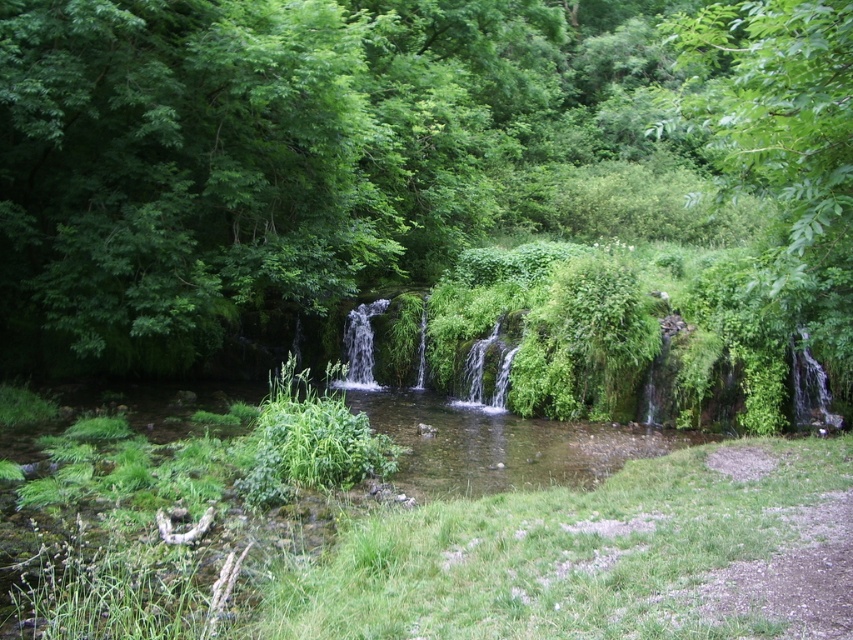
Question: Does green leafy tree at center appear under green leafy tree at upper right?

Choices:
 (A) no
 (B) yes

Answer: (B)

Question: Among these objects, which one is nearest to the camera?

Choices:
 (A) green leafy tree at center
 (B) green leafy tree at upper right

Answer: (A)

Question: Among these points, which one is farthest from the camera?

Choices:
 (A) (799, 157)
 (B) (77, 250)

Answer: (B)

Question: Is green leafy tree at center positioned in front of green leafy tree at upper right?

Choices:
 (A) no
 (B) yes

Answer: (B)

Question: Can you confirm if green leafy tree at center is thinner than green leafy tree at upper right?

Choices:
 (A) no
 (B) yes

Answer: (A)